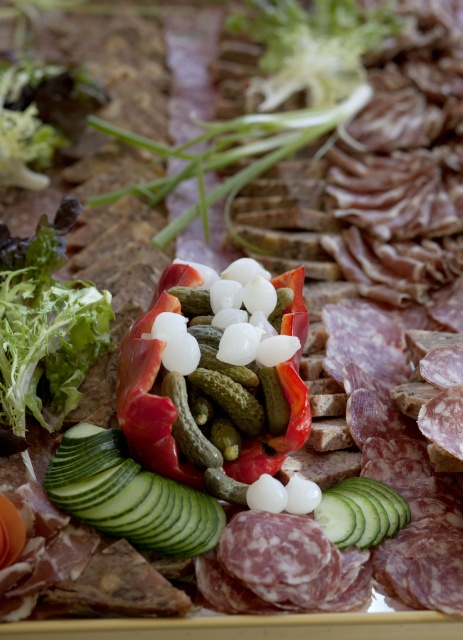
Can you confirm if green/crisp cucumber at center is taller than green crisp cucumber at center?

Yes, green/crisp cucumber at center is taller than green crisp cucumber at center.

Does point (138, 525) lie in front of point (350, 506)?

Yes, point (138, 525) is in front of point (350, 506).

Locate an element on the screen. This screenshot has height=640, width=463. green/crisp cucumber at center is located at coordinates (129, 496).

Is green/crisp cucumber at center below green pickled at center?

Yes, green/crisp cucumber at center is below green pickled at center.

Does green/crisp cucumber at center have a larger size compared to green pickled at center?

Actually, green/crisp cucumber at center might be smaller than green pickled at center.

Is point (69, 508) more distant than point (283, 362)?

No, (69, 508) is in front of (283, 362).

The width and height of the screenshot is (463, 640). I want to click on green/crisp cucumber at center, so click(129, 496).

Which is above, green pickled at center or green crisp cucumber at center?

green pickled at center is above.

What do you see at coordinates (151, 385) in the screenshot? This screenshot has width=463, height=640. I see `green pickled at center` at bounding box center [151, 385].

I want to click on green pickled at center, so click(x=151, y=385).